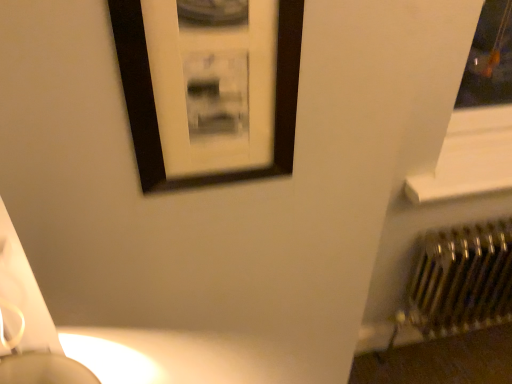
Measure the distance between metallic silver radiator at lower right and camera.

metallic silver radiator at lower right and camera are 1.33 meters apart from each other.

You are a GUI agent. You are given a task and a screenshot of the screen. Output one action in this format:
    pyautogui.click(x=<x>, y=<y>)
    Task: Click on the metallic silver radiator at lower right
    
    Given the screenshot: What is the action you would take?
    pyautogui.click(x=461, y=279)

Describe the element at coordinates (461, 279) in the screenshot. I see `metallic silver radiator at lower right` at that location.

The width and height of the screenshot is (512, 384). I want to click on metallic silver radiator at lower right, so click(x=461, y=279).